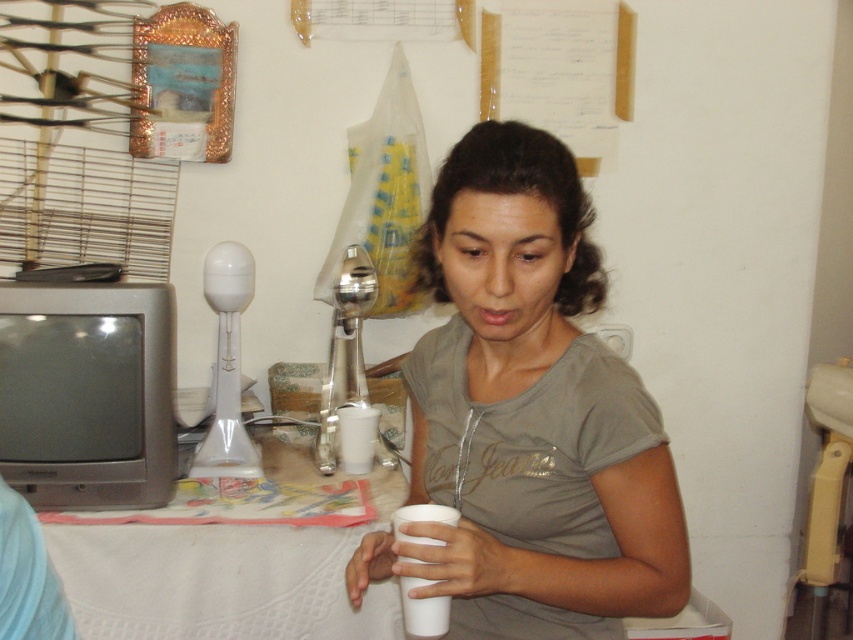
Question: Which point is closer to the camera?

Choices:
 (A) matte gray shirt at center
 (B) white paper cup at lower center
 (C) white cloth table at lower left

Answer: (A)

Question: Which is farther from the white paper cup at lower center?

Choices:
 (A) white cloth table at lower left
 (B) matte gray shirt at center

Answer: (A)

Question: Considering the relative positions of matte gray shirt at center and white cloth table at lower left in the image provided, where is matte gray shirt at center located with respect to white cloth table at lower left?

Choices:
 (A) right
 (B) left

Answer: (A)

Question: Does white cloth table at lower left appear on the left side of white paper cup at lower center?

Choices:
 (A) yes
 (B) no

Answer: (A)

Question: Estimate the real-world distances between objects in this image. Which object is closer to the matte gray shirt at center?

Choices:
 (A) white cloth table at lower left
 (B) white paper cup at lower center

Answer: (B)

Question: Does white cloth table at lower left appear on the right side of white paper cup at lower center?

Choices:
 (A) no
 (B) yes

Answer: (A)